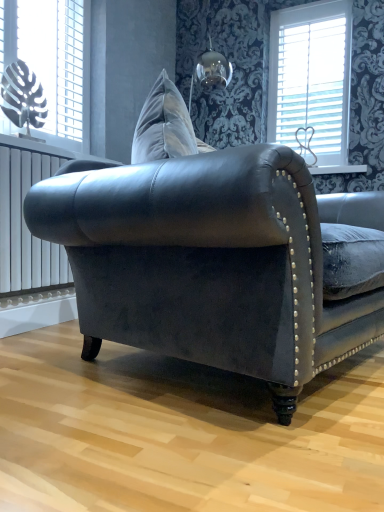
Question: From the image's perspective, is white plastic monstera leaf at upper left, which appears as the first window when viewed from the front, under white glossy window sill at upper center?

Choices:
 (A) no
 (B) yes

Answer: (A)

Question: From a real-world perspective, is white plastic monstera leaf at upper left, which is counted as the second window, starting from the back, positioned over white glossy window sill at upper center based on gravity?

Choices:
 (A) yes
 (B) no

Answer: (A)

Question: Is white plastic monstera leaf at upper left, the 1th window in the left-to-right sequence, thinner than white glossy window sill at upper center?

Choices:
 (A) yes
 (B) no

Answer: (A)

Question: Does white plastic monstera leaf at upper left, which is counted as the second window, starting from the back, have a lesser height compared to white glossy window sill at upper center?

Choices:
 (A) no
 (B) yes

Answer: (A)

Question: Is white plastic monstera leaf at upper left, which is the second window in right-to-left order, turned away from white glossy window sill at upper center?

Choices:
 (A) yes
 (B) no

Answer: (B)

Question: Can you confirm if white plastic monstera leaf at upper left, which appears as the first window when viewed from the front, is taller than white glossy window sill at upper center?

Choices:
 (A) no
 (B) yes

Answer: (B)

Question: From the image's perspective, does white wooden blinds at upper right, the 1th window in the right-to-left sequence, appear lower than white metallic radiator at left?

Choices:
 (A) no
 (B) yes

Answer: (A)

Question: Does white wooden blinds at upper right, marked as the first window in a back-to-front arrangement, have a lesser width compared to white metallic radiator at left?

Choices:
 (A) no
 (B) yes

Answer: (B)

Question: Can you confirm if white wooden blinds at upper right, the 1th window in the right-to-left sequence, is smaller than white metallic radiator at left?

Choices:
 (A) no
 (B) yes

Answer: (B)

Question: Is white wooden blinds at upper right, which is the 2th window from front to back, oriented towards white metallic radiator at left?

Choices:
 (A) no
 (B) yes

Answer: (A)

Question: From a real-world perspective, is white wooden blinds at upper right, the 1th window in the right-to-left sequence, located higher than white metallic radiator at left?

Choices:
 (A) yes
 (B) no

Answer: (A)

Question: Is white wooden blinds at upper right, marked as the first window in a back-to-front arrangement, further to the viewer compared to white metallic radiator at left?

Choices:
 (A) no
 (B) yes

Answer: (B)

Question: From the image's perspective, is white metallic radiator at left above white plastic monstera leaf at upper left, which is the second window in right-to-left order?

Choices:
 (A) no
 (B) yes

Answer: (A)